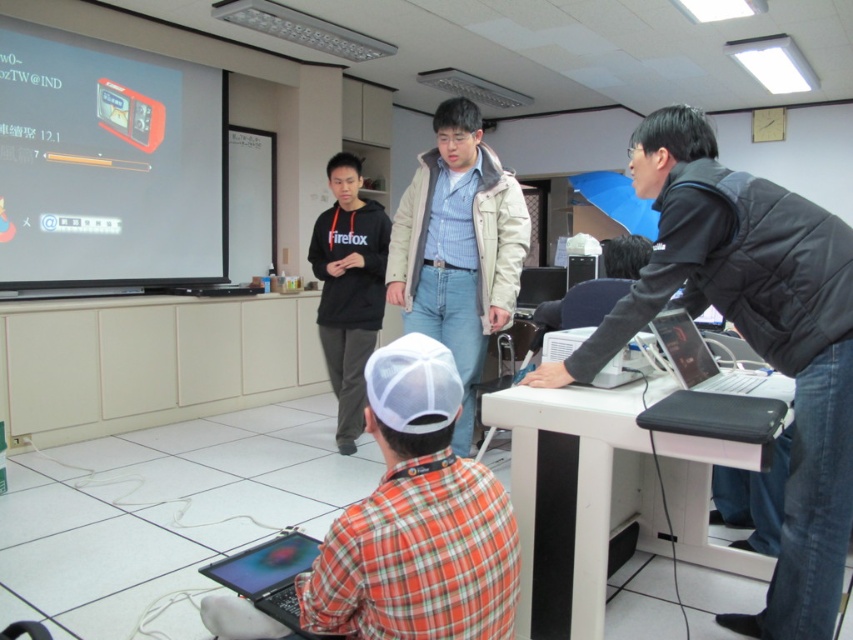
Question: Which of the following is the farthest from the observer?

Choices:
 (A) matte black laptop at lower center
 (B) matte black projector screen at upper left

Answer: (B)

Question: Which of the following is the farthest from the observer?

Choices:
 (A) (621, 525)
 (B) (364, 317)

Answer: (B)

Question: Which of the following is the farthest from the observer?

Choices:
 (A) light beige jacket at center
 (B) matte black projector screen at upper left
 (C) matte black laptop at lower center
 (D) white plastic table at lower center

Answer: (B)

Question: Can you confirm if orange plaid shirt at lower center is positioned to the right of matte black laptop at right?

Choices:
 (A) yes
 (B) no

Answer: (B)

Question: Is the position of white plastic table at lower center less distant than that of matte black laptop at right?

Choices:
 (A) yes
 (B) no

Answer: (A)

Question: Is orange plaid shirt at lower center smaller than light beige jacket at center?

Choices:
 (A) yes
 (B) no

Answer: (B)